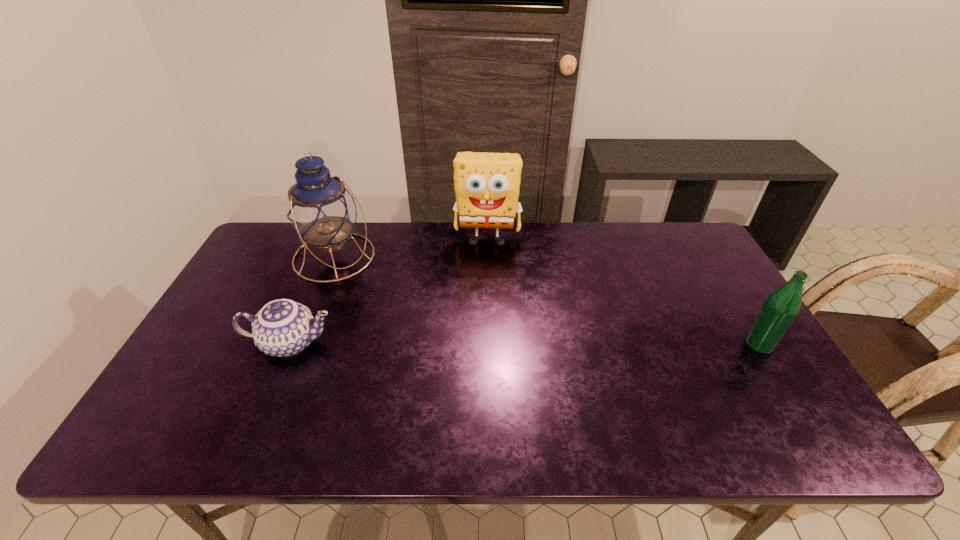
In the image, there is a desktop. Where is `free space at the far edge`? free space at the far edge is located at coordinates (534, 223).

The height and width of the screenshot is (540, 960). In the image, there is a desktop. In order to click on vacant space at the near edge in this screenshot , I will do `click(297, 396)`.

I want to click on vacant region at the left edge of the desktop, so click(212, 358).

I want to click on vacant space at the far left corner, so click(x=295, y=231).

What are the coordinates of `vacant space at the near left corner of the desktop` in the screenshot? It's located at (206, 409).

This screenshot has height=540, width=960. In the image, there is a desktop. What are the coordinates of `free space at the far right corner` in the screenshot? It's located at (658, 232).

The width and height of the screenshot is (960, 540). I want to click on vacant area that lies between the rightmost object and the sponge, so click(623, 292).

Identify the location of vacant space in between the lantern and the bottle. (547, 300).

Identify the location of free spot between the chinaware and the sponge. The image size is (960, 540). (389, 291).

What are the coordinates of `free space between the lantern and the third object from left to right` in the screenshot? It's located at (411, 248).